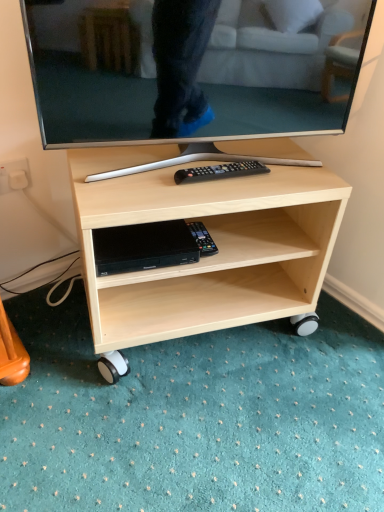
The image size is (384, 512). I want to click on free space in front of light wood/texture tv stand at center, so click(199, 430).